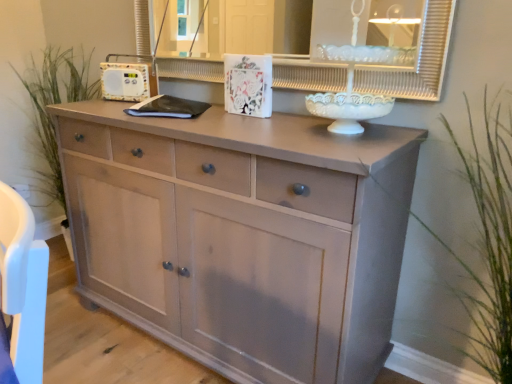
I want to click on green grass at right, placed as the first plant when sorted from right to left, so click(x=485, y=241).

Where is `white glossy medicine cabinet at upper center`? The width and height of the screenshot is (512, 384). white glossy medicine cabinet at upper center is located at coordinates (417, 61).

Describe the element at coordinates (242, 235) in the screenshot. I see `matte light wood chest of drawers at center` at that location.

The height and width of the screenshot is (384, 512). What are the coordinates of `green grass at left, the second plant when ordered from right to left` in the screenshot? It's located at [55, 103].

From a real-world perspective, which object stands above the other?

In real-world perspective, white glossy medicine cabinet at upper center is above.

From the image's perspective, which one is positioned lower, white glossy medicine cabinet at upper center or matte light wood chest of drawers at center?

matte light wood chest of drawers at center.

Is white glossy medicine cabinet at upper center bigger than matte light wood chest of drawers at center?

No.

Find the location of `medicine cabinet that appears behind the matte light wood chest of drawers at center`. medicine cabinet that appears behind the matte light wood chest of drawers at center is located at coordinates (417, 61).

Consider the image. Who is bigger, matte light wood chest of drawers at center or white glossy medicine cabinet at upper center?

Bigger between the two is matte light wood chest of drawers at center.

Based on the photo, could you tell me if matte light wood chest of drawers at center is turned towards white glossy medicine cabinet at upper center?

No, matte light wood chest of drawers at center is not turned towards white glossy medicine cabinet at upper center.

From a real-world perspective, which is physically below, matte light wood chest of drawers at center or white glossy medicine cabinet at upper center?

matte light wood chest of drawers at center, from a real-world perspective.

From the image's perspective, is white glossy medicine cabinet at upper center above or below green grass at right, placed as the first plant when sorted from right to left?

Based on their image positions, white glossy medicine cabinet at upper center is located above green grass at right, placed as the first plant when sorted from right to left.

Between white glossy medicine cabinet at upper center and green grass at right, the 2th plant in the back-to-front sequence, which one has larger width?

Answer: green grass at right, the 2th plant in the back-to-front sequence.

You are a GUI agent. You are given a task and a screenshot of the screen. Output one action in this format:
    pyautogui.click(x=<x>, y=<y>)
    Task: Click on the plant on the right of white glossy medicine cabinet at upper center
    
    Given the screenshot: What is the action you would take?
    pyautogui.click(x=485, y=241)

Considering the relative sizes of white glossy medicine cabinet at upper center and green grass at right, marked as the first plant in a front-to-back arrangement, in the image provided, is white glossy medicine cabinet at upper center taller than green grass at right, marked as the first plant in a front-to-back arrangement,?

No, white glossy medicine cabinet at upper center is not taller than green grass at right, marked as the first plant in a front-to-back arrangement.

Would you say white glossy medicine cabinet at upper center is inside or outside green grass at left, the second plant when ordered from right to left?

white glossy medicine cabinet at upper center lies outside green grass at left, the second plant when ordered from right to left.

Which is in front, point (431, 94) or point (81, 72)?

Positioned in front is point (431, 94).

How far apart are white glossy medicine cabinet at upper center and green grass at left, positioned as the 1th plant in back-to-front order?

white glossy medicine cabinet at upper center is 1.36 meters away from green grass at left, positioned as the 1th plant in back-to-front order.

Does white glossy medicine cabinet at upper center appear on the right side of green grass at left, positioned as the 1th plant in back-to-front order?

Yes, white glossy medicine cabinet at upper center is to the right of green grass at left, positioned as the 1th plant in back-to-front order.

This screenshot has width=512, height=384. In order to click on chest of drawers in front of the green grass at left, the first plant in the left-to-right sequence in this screenshot , I will do `click(242, 235)`.

From the picture: Which object is positioned more to the left, matte light wood chest of drawers at center or green grass at left, placed as the second plant when sorted from front to back?

green grass at left, placed as the second plant when sorted from front to back.

Considering the positions of point (74, 217) and point (31, 66), is point (74, 217) closer or farther from the camera than point (31, 66)?

Point (74, 217) is closer to the camera than point (31, 66).

Is green grass at left, placed as the second plant when sorted from front to back, a part of matte light wood chest of drawers at center?

That's incorrect, green grass at left, placed as the second plant when sorted from front to back, is not inside matte light wood chest of drawers at center.

From the image's perspective, is green grass at right, placed as the first plant when sorted from right to left, located above or below matte light wood chest of drawers at center?

Based on their image positions, green grass at right, placed as the first plant when sorted from right to left, is located beneath matte light wood chest of drawers at center.

Looking at this image, from a real-world perspective, between green grass at right, the 2th plant in the back-to-front sequence, and matte light wood chest of drawers at center, who is vertically lower?

matte light wood chest of drawers at center.

Does green grass at right, positioned as the second plant in left-to-right order, lie in front of matte light wood chest of drawers at center?

Yes, it is in front of matte light wood chest of drawers at center.

Is green grass at right, marked as the first plant in a front-to-back arrangement, inside or outside of matte light wood chest of drawers at center?

green grass at right, marked as the first plant in a front-to-back arrangement, is not enclosed by matte light wood chest of drawers at center.

Which is less distant, (x=500, y=364) or (x=329, y=68)?

Point (x=500, y=364).

Considering the sizes of objects green grass at right, the 2th plant in the back-to-front sequence, and white glossy medicine cabinet at upper center in the image provided, who is bigger, green grass at right, the 2th plant in the back-to-front sequence, or white glossy medicine cabinet at upper center?

Bigger between the two is green grass at right, the 2th plant in the back-to-front sequence.

Can you confirm if green grass at right, marked as the first plant in a front-to-back arrangement, is positioned to the left of white glossy medicine cabinet at upper center?

In fact, green grass at right, marked as the first plant in a front-to-back arrangement, is to the right of white glossy medicine cabinet at upper center.

Are green grass at right, placed as the first plant when sorted from right to left, and white glossy medicine cabinet at upper center beside each other?

There is a gap between green grass at right, placed as the first plant when sorted from right to left, and white glossy medicine cabinet at upper center.

I want to click on the chest of drawers in front of the white glossy medicine cabinet at upper center, so click(x=242, y=235).

This screenshot has width=512, height=384. In the image, there is a white glossy medicine cabinet at upper center. What are the coordinates of `the chest of drawers below it (from the image's perspective)` in the screenshot? It's located at (242, 235).

Based on their spatial positions, is matte light wood chest of drawers at center or green grass at right, positioned as the second plant in left-to-right order, further from white glossy medicine cabinet at upper center?

matte light wood chest of drawers at center.

Estimate the real-world distances between objects in this image. Which object is closer to matte light wood chest of drawers at center, white glossy medicine cabinet at upper center or green grass at right, marked as the first plant in a front-to-back arrangement?

The object closer to matte light wood chest of drawers at center is green grass at right, marked as the first plant in a front-to-back arrangement.

Estimate the real-world distances between objects in this image. Which object is further from white glossy medicine cabinet at upper center, green grass at right, placed as the first plant when sorted from right to left, or green grass at left, the second plant when ordered from right to left?

The object further to white glossy medicine cabinet at upper center is green grass at left, the second plant when ordered from right to left.

Considering their positions, is green grass at left, placed as the second plant when sorted from front to back, positioned closer to white glossy medicine cabinet at upper center than green grass at right, the 2th plant in the back-to-front sequence?

green grass at right, the 2th plant in the back-to-front sequence.

Based on their spatial positions, is matte light wood chest of drawers at center or green grass at left, positioned as the 1th plant in back-to-front order, further from white glossy medicine cabinet at upper center?

The object further to white glossy medicine cabinet at upper center is green grass at left, positioned as the 1th plant in back-to-front order.

Estimate the real-world distances between objects in this image. Which object is closer to matte light wood chest of drawers at center, green grass at right, positioned as the second plant in left-to-right order, or white glossy medicine cabinet at upper center?

green grass at right, positioned as the second plant in left-to-right order, is closer to matte light wood chest of drawers at center.

When comparing their distances from green grass at right, positioned as the second plant in left-to-right order, does matte light wood chest of drawers at center or green grass at left, the first plant in the left-to-right sequence, seem closer?

Among the two, matte light wood chest of drawers at center is located nearer to green grass at right, positioned as the second plant in left-to-right order.

When comparing their distances from matte light wood chest of drawers at center, does green grass at left, placed as the second plant when sorted from front to back, or green grass at right, positioned as the second plant in left-to-right order, seem closer?

The object closer to matte light wood chest of drawers at center is green grass at right, positioned as the second plant in left-to-right order.

Image resolution: width=512 pixels, height=384 pixels. I want to click on chest of drawers between green grass at left, the second plant when ordered from right to left, and green grass at right, positioned as the second plant in left-to-right order, in the horizontal direction, so click(x=242, y=235).

Identify the location of chest of drawers between green grass at left, placed as the second plant when sorted from front to back, and white glossy medicine cabinet at upper center, in the horizontal direction. (242, 235).

Where is `chest of drawers between white glossy medicine cabinet at upper center and green grass at right, the 2th plant in the back-to-front sequence, in the vertical direction`? chest of drawers between white glossy medicine cabinet at upper center and green grass at right, the 2th plant in the back-to-front sequence, in the vertical direction is located at coordinates (242, 235).

Locate an element on the screen. medicine cabinet between green grass at left, the second plant when ordered from right to left, and green grass at right, placed as the first plant when sorted from right to left, in the horizontal direction is located at coordinates (417, 61).